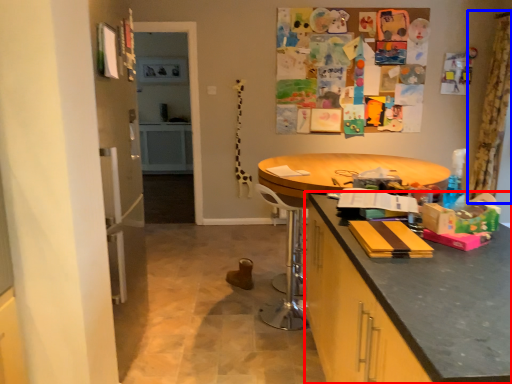
Question: Which object is closer to the camera taking this photo, cabinetry (highlighted by a red box) or curtain (highlighted by a blue box)?

Choices:
 (A) cabinetry
 (B) curtain

Answer: (A)